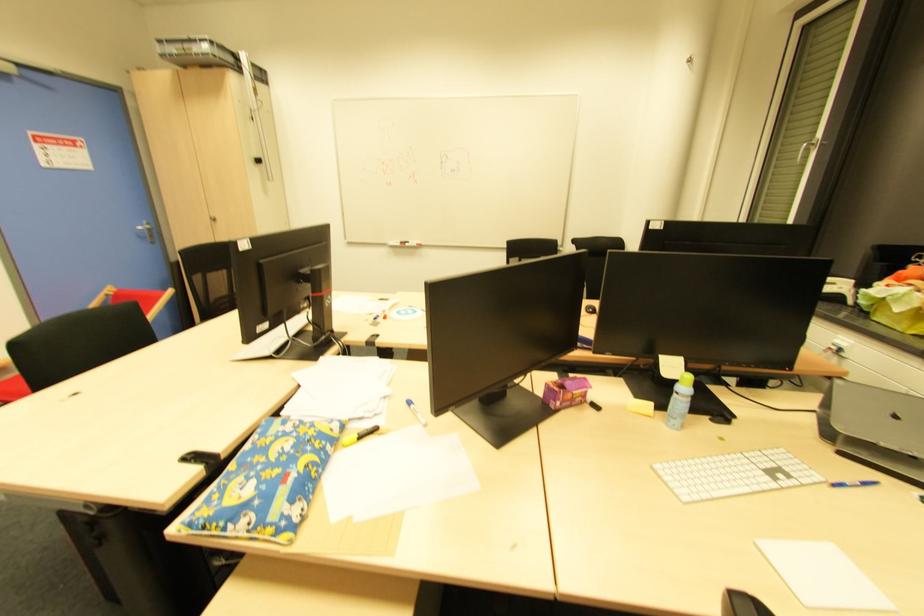
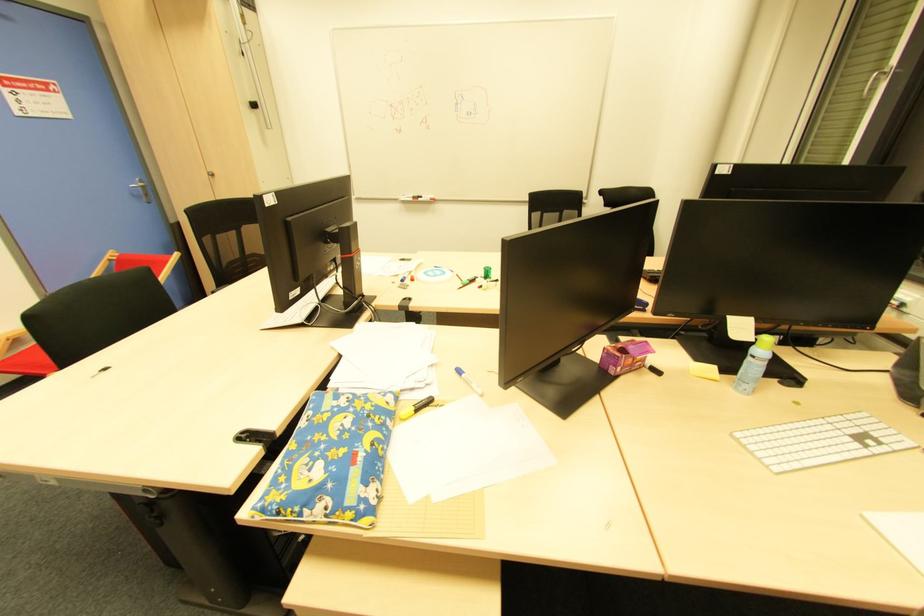
The images are taken continuously from a first-person perspective. In which direction are you moving?

The movement direction of the cameraman is left, forward.